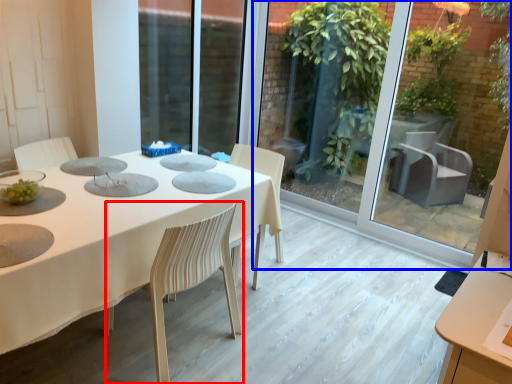
Question: Among these objects, which one is nearest to the camera, chair (highlighted by a red box) or glass door (highlighted by a blue box)?

Choices:
 (A) chair
 (B) glass door

Answer: (A)